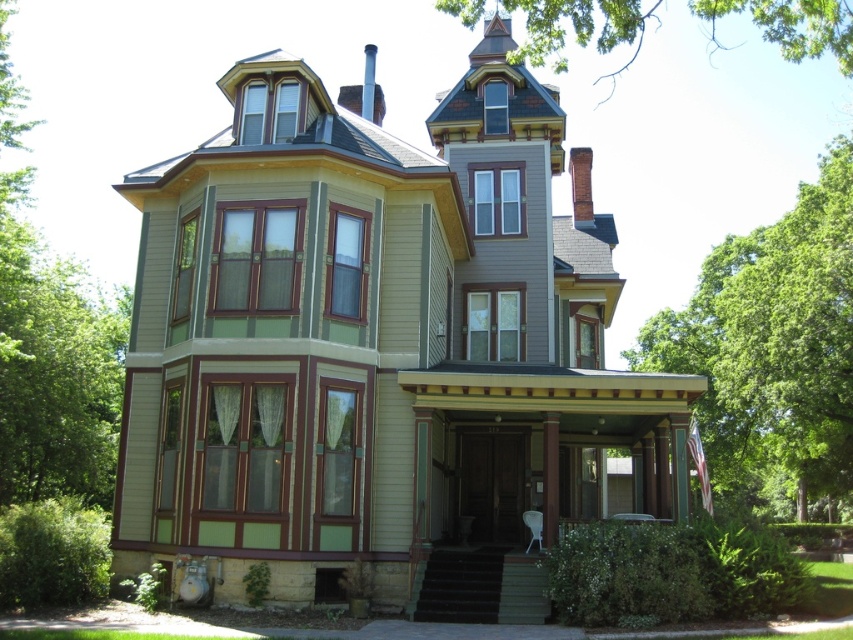
Question: Can you confirm if green leafy tree at upper right is bigger than green leafy tree at upper center?

Choices:
 (A) no
 (B) yes

Answer: (A)

Question: Does green leafy tree at upper right have a greater width compared to green leafy tree at upper center?

Choices:
 (A) no
 (B) yes

Answer: (A)

Question: Which of the following is the closest to the observer?

Choices:
 (A) click(x=821, y=228)
 (B) click(x=616, y=17)

Answer: (B)

Question: Among these objects, which one is nearest to the camera?

Choices:
 (A) green leafy tree at upper center
 (B) green leafy tree at upper right

Answer: (A)

Question: Is green leafy tree at upper right to the right of green leafy tree at upper center from the viewer's perspective?

Choices:
 (A) no
 (B) yes

Answer: (B)